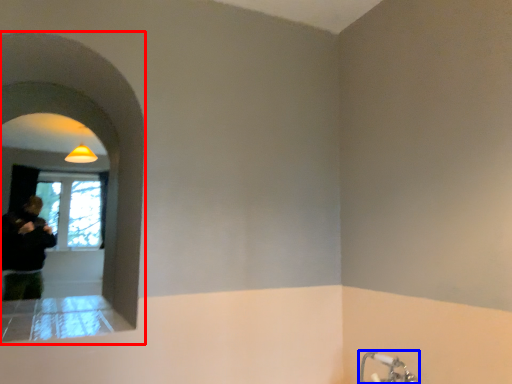
Question: Which point is further to the camera, archway (highlighted by a red box) or tap (highlighted by a blue box)?

Choices:
 (A) archway
 (B) tap

Answer: (B)